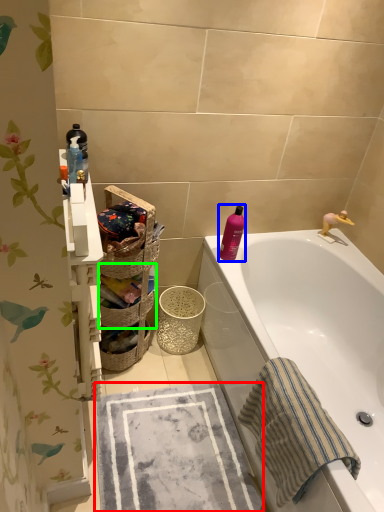
Question: Which object is positioned farthest from beach towel (highlighted by a red box)? Select from cleaning product (highlighted by a blue box) and basket (highlighted by a green box).

Choices:
 (A) cleaning product
 (B) basket

Answer: (A)